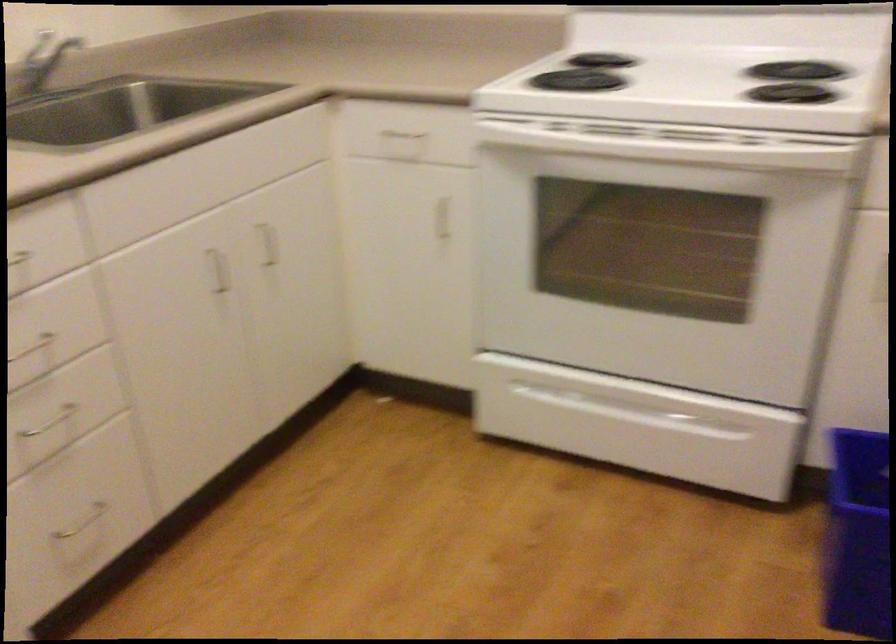
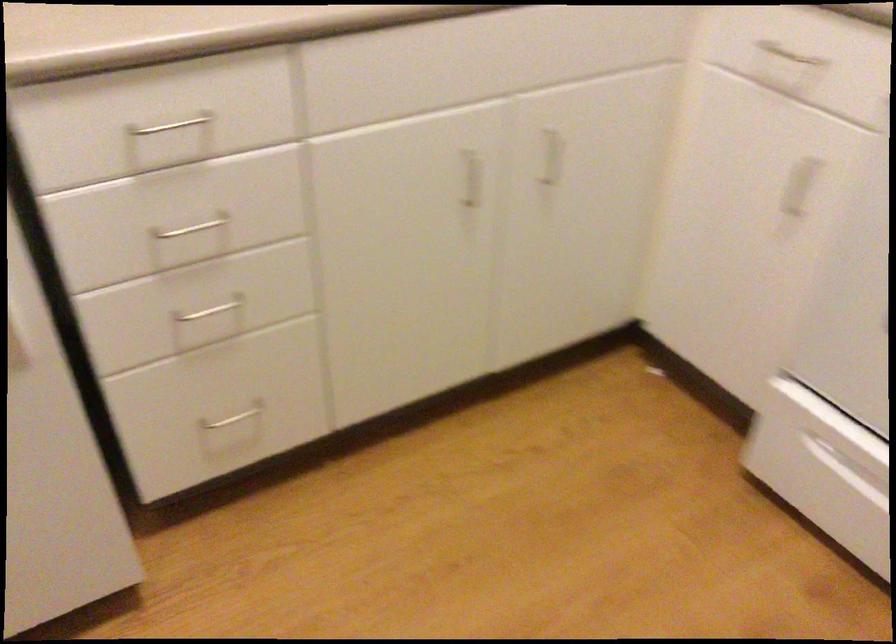
Locate, in the second image, the point that corresponds to the point at 74,534 in the first image.

(231, 419)